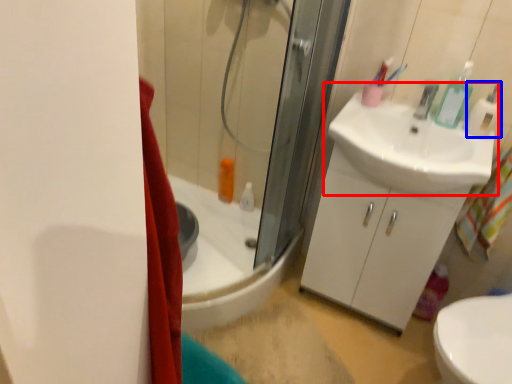
Question: Which object is further to the camera taking this photo, sink (highlighted by a red box) or soap dispenser (highlighted by a blue box)?

Choices:
 (A) sink
 (B) soap dispenser

Answer: (B)